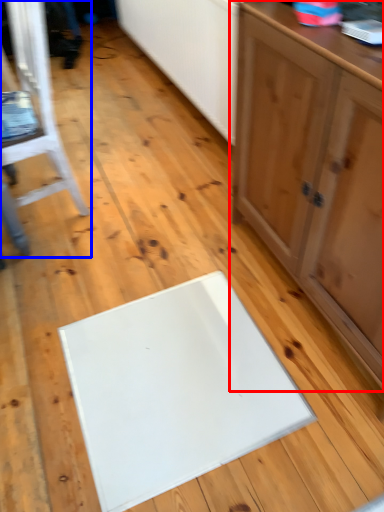
Question: Which object is closer to the camera taking this photo, cabinetry (highlighted by a red box) or furniture (highlighted by a blue box)?

Choices:
 (A) cabinetry
 (B) furniture

Answer: (A)